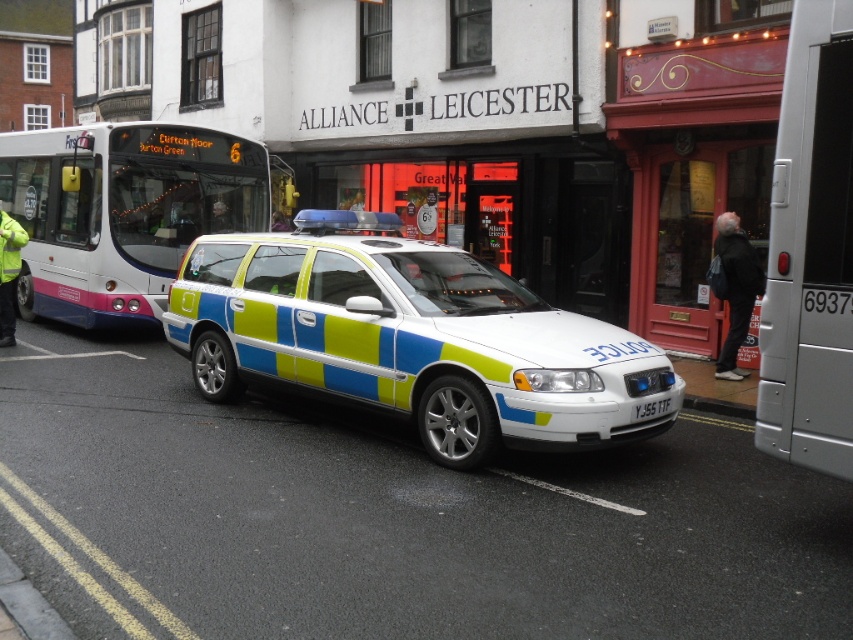
Question: Is white glossy police car at center further to the viewer compared to white plastic bus at center?

Choices:
 (A) no
 (B) yes

Answer: (A)

Question: Estimate the real-world distances between objects in this image. Which object is farther from the white glossy police car at center?

Choices:
 (A) white plastic license plate at center
 (B) yellow-green striped police car at left
 (C) metallic silver van at right

Answer: (B)

Question: Among these objects, which one is nearest to the camera?

Choices:
 (A) white plastic bus at center
 (B) white glossy police car at center
 (C) yellow-green striped police car at left
 (D) white plastic license plate at center

Answer: (B)

Question: Among these points, which one is farthest from the camera?

Choices:
 (A) (782, 224)
 (B) (12, 339)

Answer: (B)

Question: Does white glossy police car at center lie in front of white plastic bus at center?

Choices:
 (A) yes
 (B) no

Answer: (A)

Question: Does white glossy police car at center have a smaller size compared to metallic silver van at right?

Choices:
 (A) yes
 (B) no

Answer: (B)